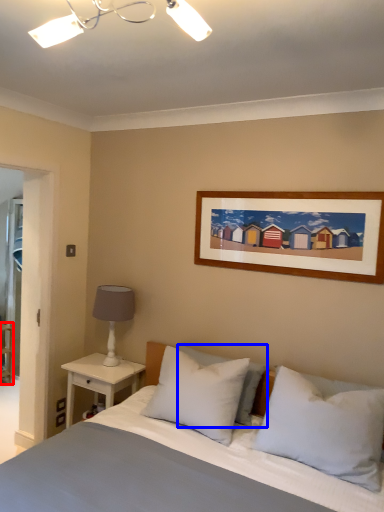
Question: Which of the following is the farthest to the observer, shelf (highlighted by a red box) or pillow (highlighted by a blue box)?

Choices:
 (A) shelf
 (B) pillow

Answer: (A)